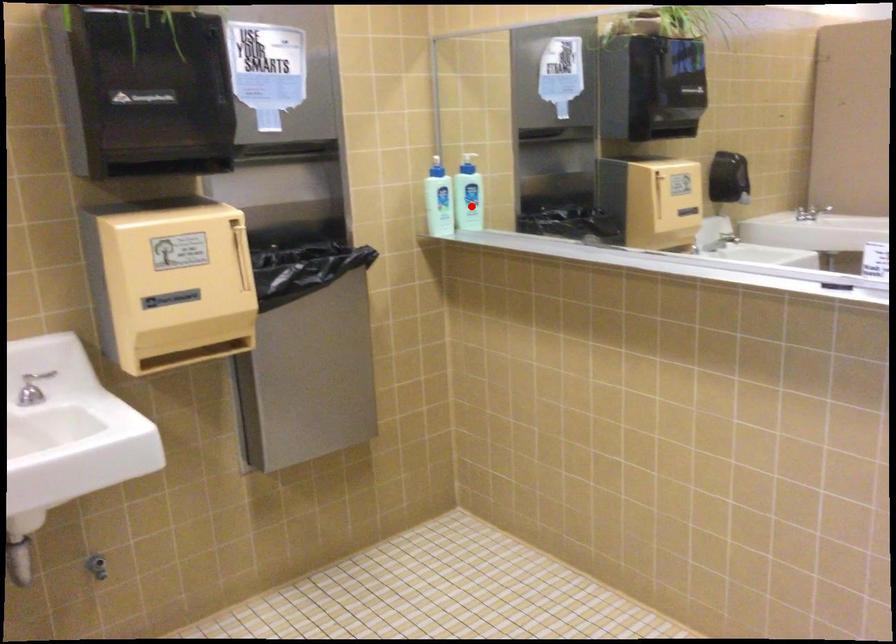
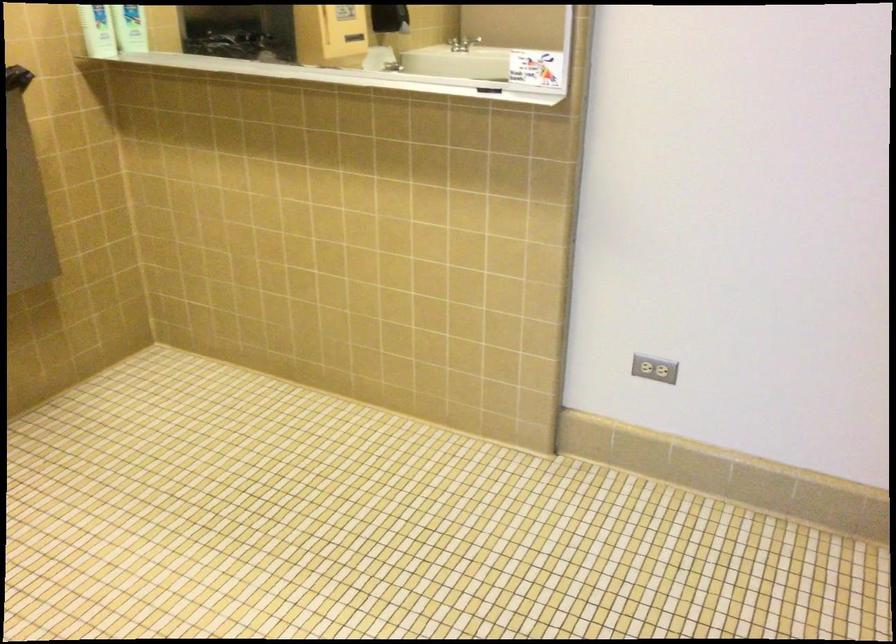
In the second image, find the point that corresponds to the highlighted location in the first image.

(131, 28)